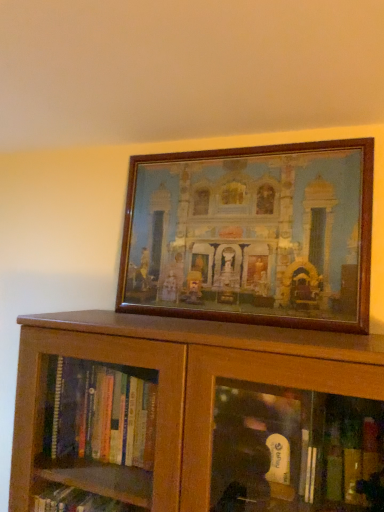
I want to click on vacant space situated above wooden picture frame at upper center (from a real-world perspective), so click(234, 148).